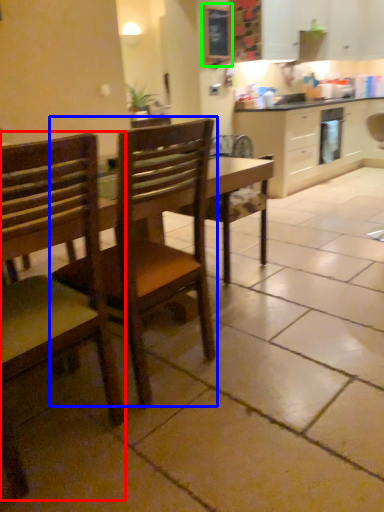
Question: Which is farther away from chair (highlighted by a red box)? chair (highlighted by a blue box) or bulletin board (highlighted by a green box)?

Choices:
 (A) chair
 (B) bulletin board

Answer: (B)